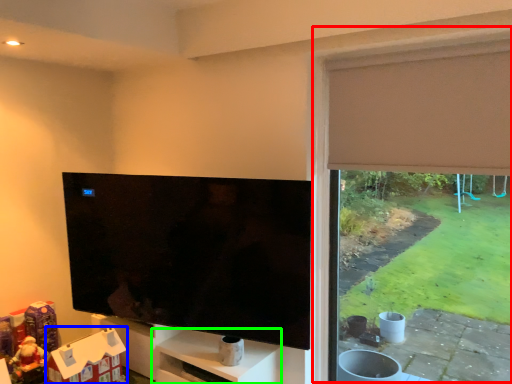
Question: Which object is positioned farthest from window frame (highlighted by a red box)? Select from toy (highlighted by a blue box) and shelf (highlighted by a green box).

Choices:
 (A) toy
 (B) shelf

Answer: (A)